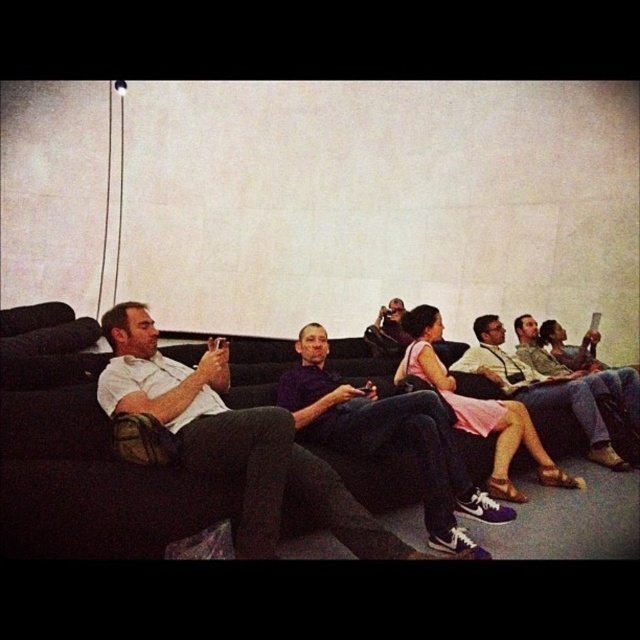
Locate an element on the screen. Image resolution: width=640 pixels, height=640 pixels. purple matte shirt at center is located at coordinates tap(388, 438).

What do you see at coordinates (388, 438) in the screenshot?
I see `purple matte shirt at center` at bounding box center [388, 438].

Is point (426, 456) closer to camera compared to point (525, 404)?

Yes, point (426, 456) is in front of point (525, 404).

Find the location of a particular element. purple matte shirt at center is located at coordinates (388, 438).

Does white matte shirt at left have a lesser width compared to matte white shirt at center?

In fact, white matte shirt at left might be wider than matte white shirt at center.

Does white matte shirt at left appear on the right side of matte white shirt at center?

In fact, white matte shirt at left is to the left of matte white shirt at center.

Is point (262, 422) closer to viewer compared to point (499, 340)?

Yes, point (262, 422) is in front of point (499, 340).

I want to click on white matte shirt at left, so click(x=232, y=438).

How distant is white matte shirt at left from purple matte shirt at center?

They are 58.28 centimeters apart.

Does white matte shirt at left come in front of purple matte shirt at center?

Yes.

Where is `white matte shirt at left`? This screenshot has width=640, height=640. white matte shirt at left is located at coordinates pos(232,438).